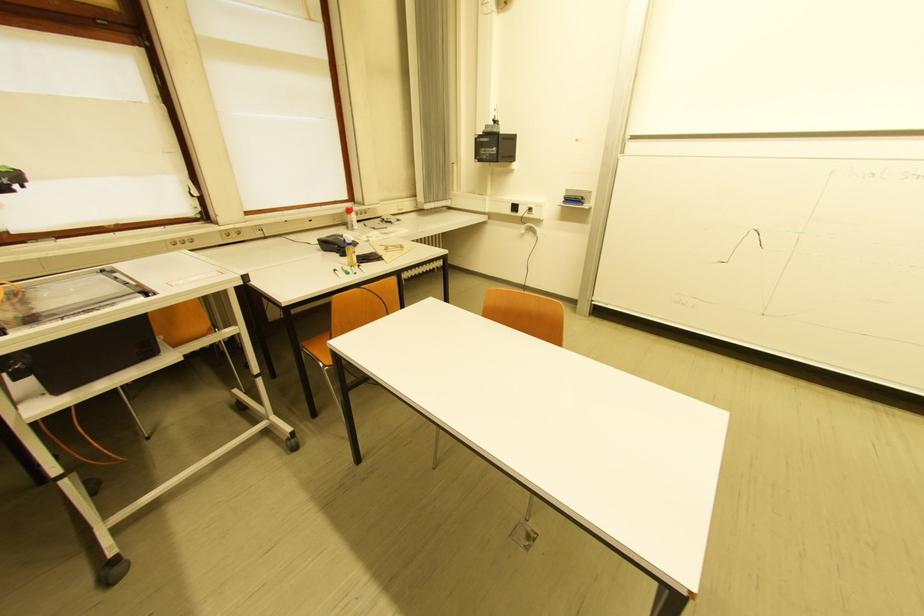
The height and width of the screenshot is (616, 924). What are the coordinates of `orange chair surface` in the screenshot? It's located at (321, 346).